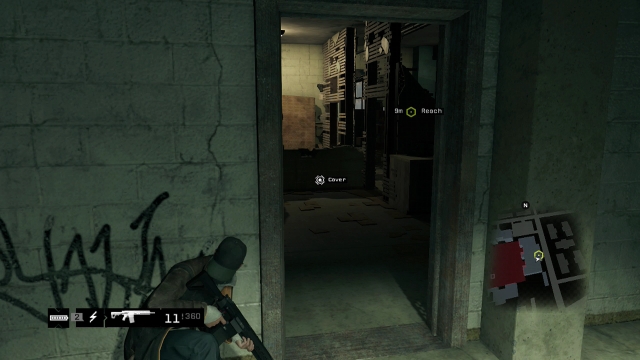
Find the location of a particular element. The height and width of the screenshot is (360, 640). doorway is located at coordinates (387, 262).